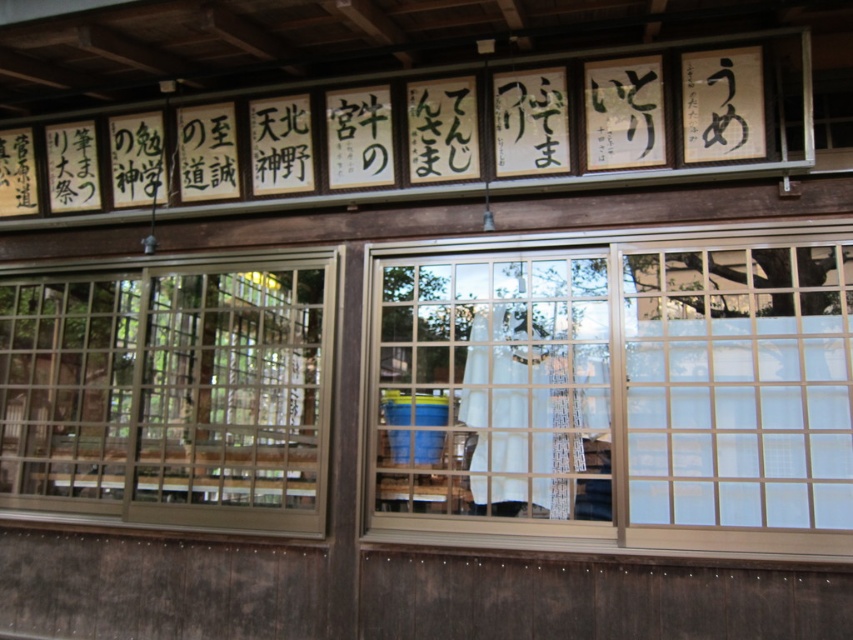
You are a delivery person approaching the traditional Japanese building and need to choose between the clear glass window at center and the clear glass window at left to deliver a package. Which window should you choose if you need to place the package on the sill of the smaller window?

The clear glass window at center has a smaller size compared to the clear glass window at left, so you should choose the clear glass window at center to place the package on its sill.

In the scene shown: You are standing in front of the traditional Japanese building and notice two points marked on the facade. The first point is at coordinate point (798,330) and the second is at point (39,387). Which point is closer to your eyes?

Point (798,330) is closer to the camera than point (39,387).

You are standing in front of the traditional Japanese building and want to place a 5 feet wide decorative mat between the clear glass window at center and the clear glass window at left. Will the mat fit between them?

The clear glass window at center and clear glass window at left are 4.82 feet apart. Since the decorative mat is 5 feet wide, it will not fit between them as the distance is slightly less than the mat.